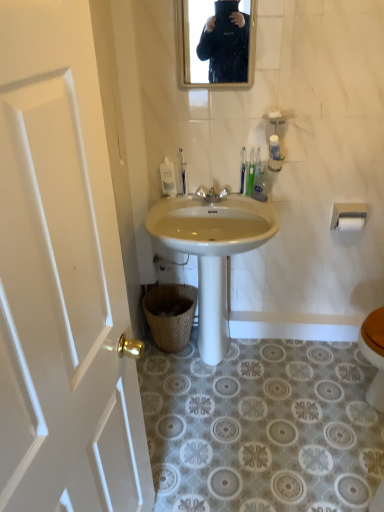
Question: In which direction should I rotate to look at white plastic toothbrush at upper center, which ranks as the 2th toilet brush in left-to-right order?

Choices:
 (A) right
 (B) left

Answer: (A)

Question: Is white matte toilet paper at upper right, placed as the first toilet paper when sorted from bottom to top, far from green plastic toothbrush at upper center?

Choices:
 (A) no
 (B) yes

Answer: (A)

Question: Can you confirm if white matte toilet paper at upper right, the 2th toilet paper positioned from the top, is wider than green plastic toothbrush at upper center?

Choices:
 (A) yes
 (B) no

Answer: (A)

Question: Is white matte toilet paper at upper right, the 2th toilet paper positioned from the top, at the left side of green plastic toothbrush at upper center?

Choices:
 (A) yes
 (B) no

Answer: (B)

Question: From a real-world perspective, does white matte toilet paper at upper right, placed as the first toilet paper when sorted from bottom to top, stand above green plastic toothbrush at upper center?

Choices:
 (A) yes
 (B) no

Answer: (B)

Question: Is the depth of white matte toilet paper at upper right, the 2th toilet paper positioned from the top, greater than that of green plastic toothbrush at upper center?

Choices:
 (A) yes
 (B) no

Answer: (A)

Question: Is white matte toilet paper at upper right, the 2th toilet paper positioned from the top, completely or partially outside of green plastic toothbrush at upper center?

Choices:
 (A) yes
 (B) no

Answer: (A)

Question: Does white plastic toilet brush at center, which is counted as the third toilet brush, starting from the right, appear on the right side of matte black mirror at upper center?

Choices:
 (A) yes
 (B) no

Answer: (B)

Question: Does white plastic toilet brush at center, which is counted as the third toilet brush, starting from the right, lie in front of matte black mirror at upper center?

Choices:
 (A) no
 (B) yes

Answer: (A)

Question: Does white plastic toilet brush at center, which is the first toilet brush in left-to-right order, touch matte black mirror at upper center?

Choices:
 (A) yes
 (B) no

Answer: (B)

Question: From a real-world perspective, is white plastic toilet brush at center, which is the first toilet brush in left-to-right order, on matte black mirror at upper center?

Choices:
 (A) no
 (B) yes

Answer: (A)

Question: Does white plastic toilet brush at center, which is the first toilet brush in left-to-right order, have a greater height compared to matte black mirror at upper center?

Choices:
 (A) no
 (B) yes

Answer: (A)

Question: Does white plastic toilet brush at center, which is counted as the third toilet brush, starting from the right, have a lesser height compared to matte black mirror at upper center?

Choices:
 (A) no
 (B) yes

Answer: (B)

Question: Is white glossy sink at center closer to camera compared to white matte toilet paper at upper right, the 2th toilet paper when ordered from bottom to top?

Choices:
 (A) no
 (B) yes

Answer: (B)